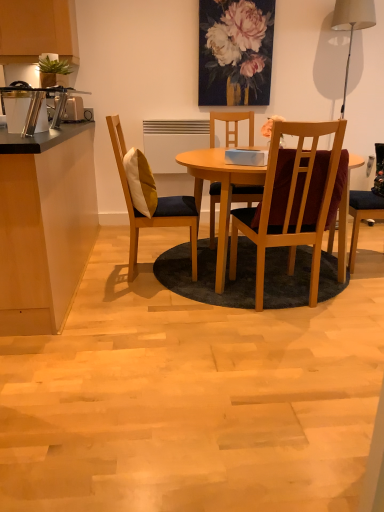
The height and width of the screenshot is (512, 384). In order to click on matte floral painting at upper center in this screenshot , I will do `click(237, 32)`.

What do you see at coordinates (352, 25) in the screenshot? The width and height of the screenshot is (384, 512). I see `white fabric lampshade at upper right` at bounding box center [352, 25].

The image size is (384, 512). Identify the location of white fabric lampshade at upper right. (352, 25).

In order to face matte wood cabinet at upper left, should I rotate leftwards or rightwards?

A 20.470 degree turn to the left will do.

Describe the element at coordinates (37, 30) in the screenshot. I see `matte wood cabinet at upper left` at that location.

This screenshot has width=384, height=512. I want to click on metallic silver toaster at left, so click(36, 106).

At what (x,y) coordinates should I click in order to perform the action: click on wooden chair with cushion at left, the first chair in the left-to-right sequence. Please return your answer as a coordinate pair (x, y). This screenshot has height=512, width=384. Looking at the image, I should click on (156, 207).

What is the approximate height of wooden chair at center, which is the 2th chair in left-to-right order?

98.58 centimeters.

Identify the location of silver metallic toaster at left. This screenshot has height=512, width=384. (73, 109).

Which object is thinner, black laminate countertop at left or wooden chair with cushion at left, the first chair in the left-to-right sequence?

With smaller width is wooden chair with cushion at left, the first chair in the left-to-right sequence.

Based on the photo, does black laminate countertop at left lie in front of wooden chair with cushion at left, the first chair in the left-to-right sequence?

Yes.

Considering the positions of points (50, 284) and (132, 261), is point (50, 284) farther from camera compared to point (132, 261)?

That is False.

Consider the image. Is black laminate countertop at left not within wooden chair with cushion at left, acting as the 2th chair starting from the right?

black laminate countertop at left lies outside wooden chair with cushion at left, acting as the 2th chair starting from the right,'s area.

Considering the relative sizes of black laminate countertop at left and matte yellow pillow at center in the image provided, is black laminate countertop at left smaller than matte yellow pillow at center?

Incorrect, black laminate countertop at left is not smaller in size than matte yellow pillow at center.

From a real-world perspective, is black laminate countertop at left above or below matte yellow pillow at center?

black laminate countertop at left is below matte yellow pillow at center.

Which of these two, black laminate countertop at left or matte yellow pillow at center, stands taller?

Standing taller between the two is black laminate countertop at left.

From their relative heights in the image, would you say wooden chair with cushion at left, acting as the 2th chair starting from the right, is taller or shorter than matte floral painting at upper center?

In the image, wooden chair with cushion at left, acting as the 2th chair starting from the right, appears to be taller than matte floral painting at upper center.

From a real-world perspective, relative to matte floral painting at upper center, is wooden chair with cushion at left, acting as the 2th chair starting from the right, vertically above or below?

wooden chair with cushion at left, acting as the 2th chair starting from the right, is situated lower than matte floral painting at upper center in the real world.

Is wooden chair with cushion at left, the first chair in the left-to-right sequence, not close to matte floral painting at upper center?

Yes.

Does wooden chair with cushion at left, acting as the 2th chair starting from the right, have a larger size compared to matte floral painting at upper center?

Yes.

Between white fabric lampshade at upper right and black laminate countertop at left, which one has less height?

black laminate countertop at left.

Is white fabric lampshade at upper right placed right next to black laminate countertop at left?

white fabric lampshade at upper right and black laminate countertop at left are clearly separated.

Which object is further away from the camera taking this photo, white fabric lampshade at upper right or black laminate countertop at left?

white fabric lampshade at upper right is behind.

From a real-world perspective, which object rests below the other?

black laminate countertop at left, from a real-world perspective.

Consider the image. Is matte wood cabinet at upper left placed right next to matte floral painting at upper center?

No, matte wood cabinet at upper left is not making contact with matte floral painting at upper center.

Does matte wood cabinet at upper left appear on the right side of matte floral painting at upper center?

Incorrect, matte wood cabinet at upper left is not on the right side of matte floral painting at upper center.

Is matte wood cabinet at upper left oriented away from matte floral painting at upper center?

No.

Between matte wood cabinet at upper left and matte floral painting at upper center, which one has larger size?

With larger size is matte wood cabinet at upper left.

Between wooden chair at center, arranged as the 1th chair when viewed from the right, and matte wood cabinet at upper left, which one appears on the right side from the viewer's perspective?

From the viewer's perspective, wooden chair at center, arranged as the 1th chair when viewed from the right, appears more on the right side.

Is wooden chair at center, which is the 2th chair in left-to-right order, facing towards matte wood cabinet at upper left?

No, wooden chair at center, which is the 2th chair in left-to-right order, is not oriented towards matte wood cabinet at upper left.

Which is further, (x=282, y=195) or (x=29, y=54)?

Point (x=29, y=54)

How much distance is there between matte yellow pillow at center and wooden chair at center, arranged as the 1th chair when viewed from the right?

matte yellow pillow at center is 31.55 inches away from wooden chair at center, arranged as the 1th chair when viewed from the right.

Does matte yellow pillow at center lie behind wooden chair at center, arranged as the 1th chair when viewed from the right?

Yes, it is.

Between point (137, 167) and point (307, 168), which one is positioned in front?

The point (307, 168) is in front.

Would you consider matte yellow pillow at center to be distant from wooden chair at center, arranged as the 1th chair when viewed from the right?

No, matte yellow pillow at center is not far away from wooden chair at center, arranged as the 1th chair when viewed from the right.

This screenshot has width=384, height=512. Find the location of `counter top located underneath the wooden chair with cushion at left, acting as the 2th chair starting from the right (from a real-world perspective)`. counter top located underneath the wooden chair with cushion at left, acting as the 2th chair starting from the right (from a real-world perspective) is located at coordinates (45, 228).

At what (x,y) coordinates should I click in order to perform the action: click on counter top on the left of matte yellow pillow at center. Please return your answer as a coordinate pair (x, y). Looking at the image, I should click on (45, 228).

Which object lies further to the anchor point matte floral painting at upper center, white fabric lampshade at upper right or wooden chair at center, arranged as the 1th chair when viewed from the right?

wooden chair at center, arranged as the 1th chair when viewed from the right, lies further to matte floral painting at upper center than the other object.

Estimate the real-world distances between objects in this image. Which object is further from silver metallic toaster at left, wooden chair with cushion at left, the first chair in the left-to-right sequence, or metallic silver toaster at left?

Based on the image, wooden chair with cushion at left, the first chair in the left-to-right sequence, appears to be further to silver metallic toaster at left.

Based on their spatial positions, is matte wood cabinet at upper left or matte floral painting at upper center further from wooden chair with cushion at left, acting as the 2th chair starting from the right?

matte floral painting at upper center is further to wooden chair with cushion at left, acting as the 2th chair starting from the right.

Looking at the image, which one is located closer to metallic silver toaster at left, matte wood cabinet at upper left or white fabric lampshade at upper right?

matte wood cabinet at upper left.

Which object lies further to the anchor point wooden chair at center, arranged as the 1th chair when viewed from the right, matte yellow pillow at center or metallic silver toaster at left?

Based on the image, metallic silver toaster at left appears to be further to wooden chair at center, arranged as the 1th chair when viewed from the right.

Looking at the image, which one is located further to matte yellow pillow at center, wooden table at center or matte wood cabinet at upper left?

matte wood cabinet at upper left lies further to matte yellow pillow at center than the other object.

From the image, which object appears to be farther from black laminate countertop at left, matte wood cabinet at upper left or matte yellow pillow at center?

Based on the image, matte wood cabinet at upper left appears to be further to black laminate countertop at left.

From the image, which object appears to be farther from matte floral painting at upper center, black laminate countertop at left or matte yellow pillow at center?

black laminate countertop at left.

The width and height of the screenshot is (384, 512). I want to click on pillow between matte floral painting at upper center and wooden chair at center, which is the 2th chair in left-to-right order, vertically, so click(140, 182).

At what (x,y) coordinates should I click in order to perform the action: click on appliance between black laminate countertop at left and wooden chair with cushion at left, acting as the 2th chair starting from the right. Please return your answer as a coordinate pair (x, y). This screenshot has width=384, height=512. Looking at the image, I should click on (36, 106).

Identify the location of chair between matte floral painting at upper center and wooden chair at center, which is the 2th chair in left-to-right order, in the up-down direction. The image size is (384, 512). (156, 207).

This screenshot has height=512, width=384. Identify the location of kitchen & dining room table between matte yellow pillow at center and white fabric lampshade at upper right in the horizontal direction. (194, 195).